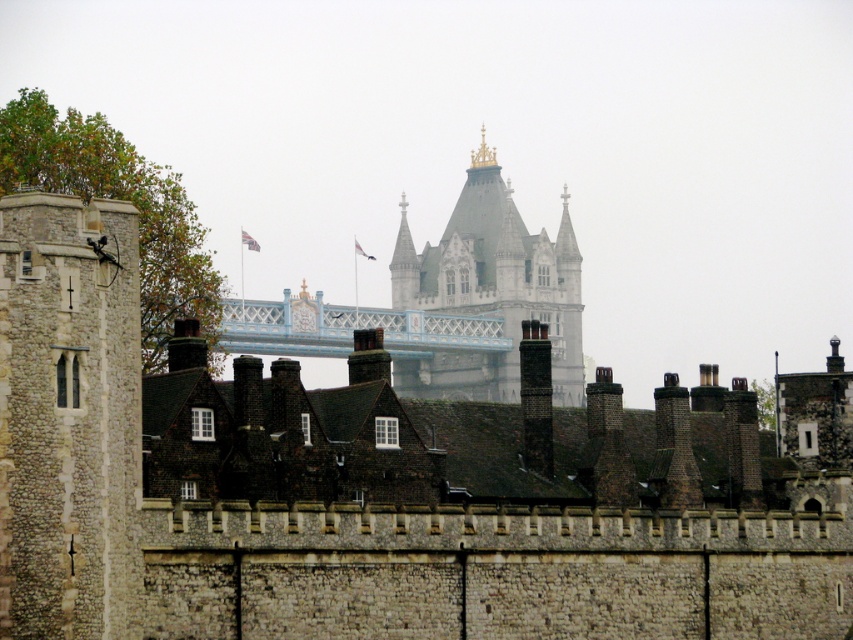
You are a tourist visiting the Tower of London and want to take a photo of the white stone tower at center from the light blue painted metal bridge at center. Which side of the bridge should you stand on to have the tower in the background?

The white stone tower at center is positioned on the right side of the light blue painted metal bridge at center, so you should stand on the right side of the light blue painted metal bridge at center to have the tower in the background.